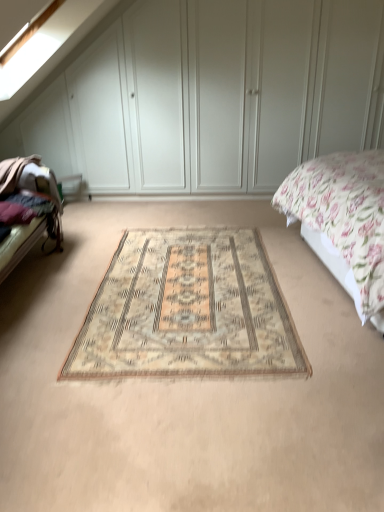
Question: Could you tell me if beige woven rug at center is facing white matte wardrobe at center?

Choices:
 (A) yes
 (B) no

Answer: (B)

Question: Is beige woven rug at center looking in the opposite direction of white matte wardrobe at center?

Choices:
 (A) no
 (B) yes

Answer: (B)

Question: Considering the relative positions of beige woven rug at center and white matte wardrobe at center in the image provided, is beige woven rug at center to the right of white matte wardrobe at center from the viewer's perspective?

Choices:
 (A) yes
 (B) no

Answer: (A)

Question: Is beige woven rug at center at the left side of white matte wardrobe at center?

Choices:
 (A) no
 (B) yes

Answer: (A)

Question: Would you say beige woven rug at center is a long distance from white matte wardrobe at center?

Choices:
 (A) no
 (B) yes

Answer: (B)

Question: Is beige carpet at center bigger or smaller than dark brown fabric bed frame at left?

Choices:
 (A) big
 (B) small

Answer: (A)

Question: From the image's perspective, is beige carpet at center above or below dark brown fabric bed frame at left?

Choices:
 (A) above
 (B) below

Answer: (B)

Question: In terms of width, does beige carpet at center look wider or thinner when compared to dark brown fabric bed frame at left?

Choices:
 (A) wide
 (B) thin

Answer: (A)

Question: Is beige carpet at center to the left or to the right of dark brown fabric bed frame at left in the image?

Choices:
 (A) right
 (B) left

Answer: (A)

Question: Is beige carpet at center wider or thinner than beige woven rug at center?

Choices:
 (A) thin
 (B) wide

Answer: (B)

Question: Is point (253, 470) positioned closer to the camera than point (119, 289)?

Choices:
 (A) farther
 (B) closer

Answer: (B)

Question: From a real-world perspective, relative to beige woven rug at center, is beige carpet at center vertically above or below?

Choices:
 (A) above
 (B) below

Answer: (A)

Question: Relative to beige woven rug at center, is beige carpet at center in front or behind?

Choices:
 (A) front
 (B) behind

Answer: (A)

Question: Based on their positions, is white matte wardrobe at center located to the left or right of dark brown fabric bed frame at left?

Choices:
 (A) right
 (B) left

Answer: (A)

Question: In terms of height, does white matte wardrobe at center look taller or shorter compared to dark brown fabric bed frame at left?

Choices:
 (A) short
 (B) tall

Answer: (B)